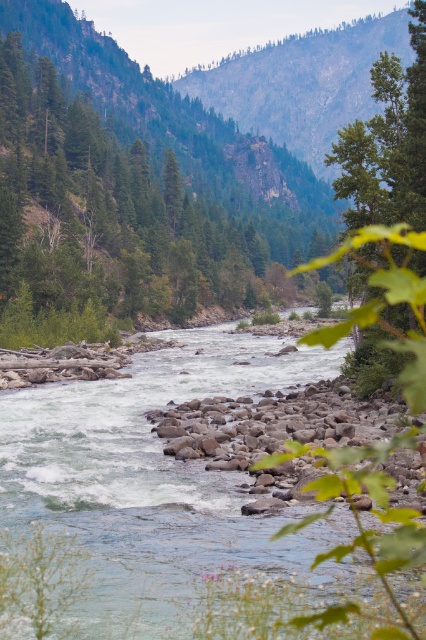
Question: Among these points, which one is nearest to the camera?

Choices:
 (A) (290, 298)
 (B) (26, 410)

Answer: (B)

Question: Can you confirm if white smooth water at center is positioned above green leafy tree at center?

Choices:
 (A) yes
 (B) no

Answer: (B)

Question: Is white smooth water at center thinner than green leafy tree at center?

Choices:
 (A) no
 (B) yes

Answer: (B)

Question: Can you confirm if white smooth water at center is positioned to the left of green leafy tree at center?

Choices:
 (A) yes
 (B) no

Answer: (B)

Question: Which of the following is the closest to the observer?

Choices:
 (A) green leafy tree at center
 (B) white smooth water at center

Answer: (B)